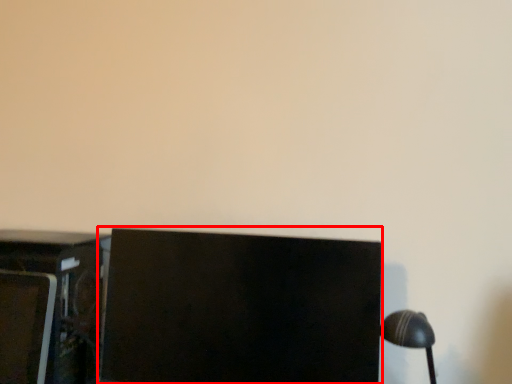
Question: Observing the image, what is the correct spatial positioning of computer monitor (annotated by the red box) in reference to furniture?

Choices:
 (A) right
 (B) left

Answer: (A)